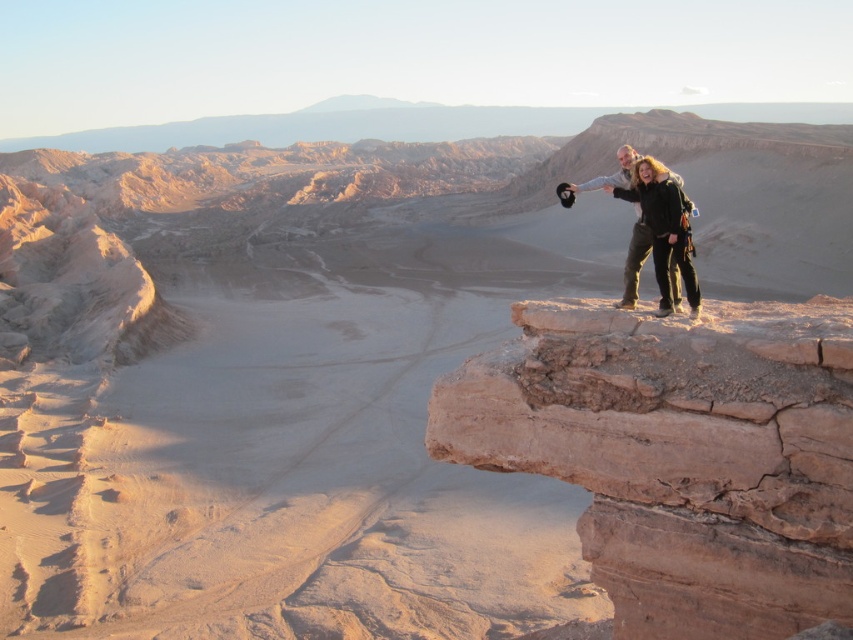
Between point (587, 342) and point (637, 186), which one is positioned behind?

The point (637, 186) is behind.

From the picture: How distant is brown rocky cliff at upper right from dark green pants at right?

A distance of 6.07 meters exists between brown rocky cliff at upper right and dark green pants at right.

Measure the distance between brown rocky cliff at upper right and camera.

The distance of brown rocky cliff at upper right from camera is 22.63 meters.

Identify the location of brown rocky cliff at upper right. (680, 454).